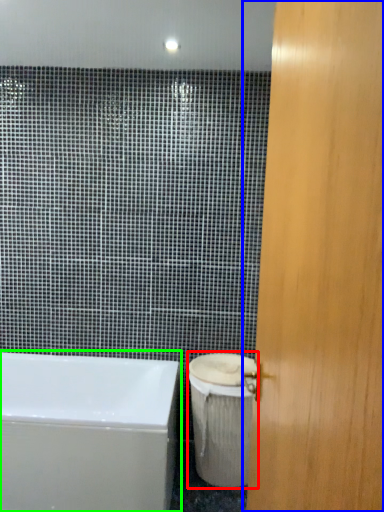
Question: Which object is positioned farthest from toilet bowl (highlighted by a red box)? Select from door (highlighted by a blue box) and bathtub (highlighted by a green box).

Choices:
 (A) door
 (B) bathtub

Answer: (A)